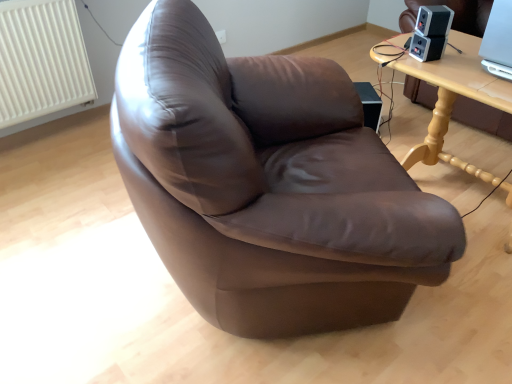
Where is `vacant position to the left of satin black speaker at upper right, the 1th speaker when ordered from bottom to top`? This screenshot has height=384, width=512. vacant position to the left of satin black speaker at upper right, the 1th speaker when ordered from bottom to top is located at coordinates (395, 53).